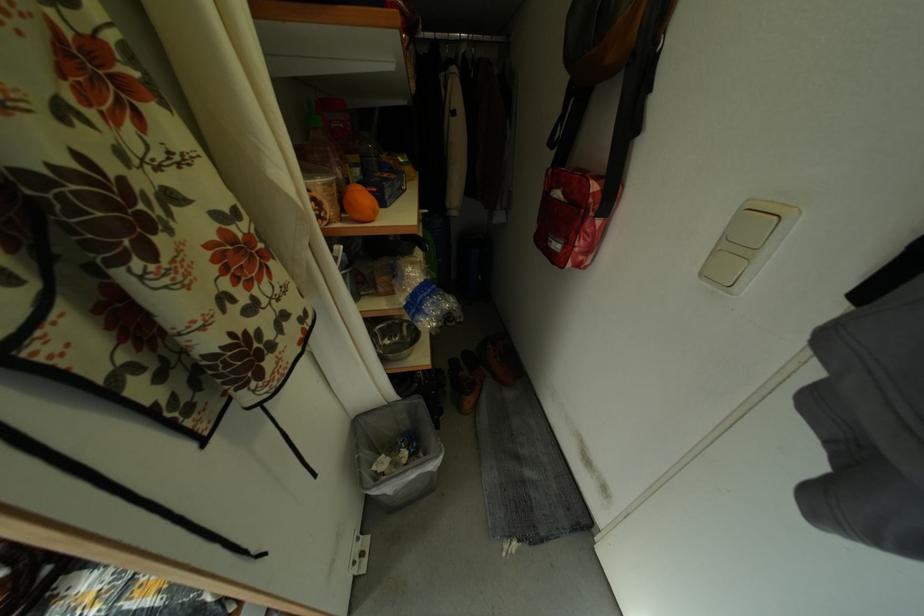
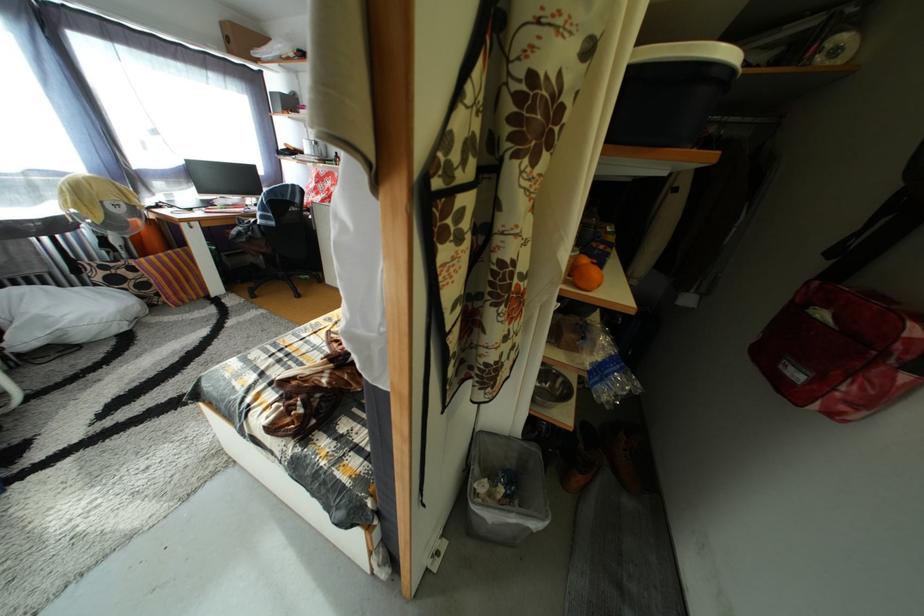
Question: The first image is from the beginning of the video and the second image is from the end. How did the camera likely rotate when shooting the video?

Choices:
 (A) Left
 (B) Right
 (C) Up
 (D) Down

Answer: (A)